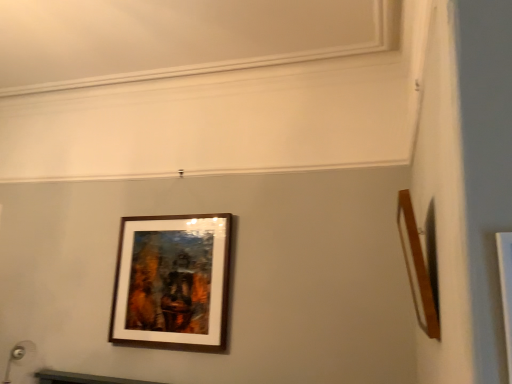
Question: Could you tell me if wooden frame at right, the 2th picture frame in the left-to-right sequence, is turned towards wooden frame at center, which appears as the first picture frame when viewed from the back?

Choices:
 (A) no
 (B) yes

Answer: (B)

Question: Considering the relative positions of wooden frame at right, which is the 1th picture frame in right-to-left order, and wooden frame at center, which appears as the first picture frame when viewed from the back, in the image provided, is wooden frame at right, which is the 1th picture frame in right-to-left order, behind wooden frame at center, which appears as the first picture frame when viewed from the back,?

Choices:
 (A) yes
 (B) no

Answer: (B)

Question: Would you say wooden frame at right, which is the 1th picture frame in right-to-left order, is outside wooden frame at center, which ranks as the 2th picture frame in front-to-back order?

Choices:
 (A) no
 (B) yes

Answer: (B)

Question: From a real-world perspective, is wooden frame at right, which is the 1th picture frame in right-to-left order, on top of wooden frame at center, which appears as the first picture frame when viewed from the back?

Choices:
 (A) no
 (B) yes

Answer: (B)

Question: Considering the relative sizes of wooden frame at right, placed as the first picture frame when sorted from front to back, and wooden frame at center, which ranks as the 2th picture frame in front-to-back order, in the image provided, is wooden frame at right, placed as the first picture frame when sorted from front to back, shorter than wooden frame at center, which ranks as the 2th picture frame in front-to-back order,?

Choices:
 (A) no
 (B) yes

Answer: (B)

Question: Is wooden frame at center, positioned as the 1th picture frame in left-to-right order, inside wooden frame at right, the 2th picture frame in the left-to-right sequence?

Choices:
 (A) no
 (B) yes

Answer: (A)

Question: Can you confirm if wooden frame at center, positioned as the second picture frame in right-to-left order, is wider than wooden frame at right, the 2th picture frame in the left-to-right sequence?

Choices:
 (A) yes
 (B) no

Answer: (B)

Question: From a real-world perspective, is wooden frame at center, which ranks as the 2th picture frame in front-to-back order, beneath wooden frame at right, the 2th picture frame in the left-to-right sequence?

Choices:
 (A) yes
 (B) no

Answer: (A)

Question: Considering the relative positions of wooden frame at center, which appears as the first picture frame when viewed from the back, and wooden frame at right, which is the 1th picture frame in right-to-left order, in the image provided, is wooden frame at center, which appears as the first picture frame when viewed from the back, behind wooden frame at right, which is the 1th picture frame in right-to-left order,?

Choices:
 (A) no
 (B) yes

Answer: (B)

Question: Can you confirm if wooden frame at center, positioned as the second picture frame in right-to-left order, is positioned to the left of wooden frame at right, the 2th picture frame in the left-to-right sequence?

Choices:
 (A) no
 (B) yes

Answer: (B)

Question: From the image's perspective, is wooden frame at center, which appears as the first picture frame when viewed from the back, above wooden frame at right, placed as the first picture frame when sorted from front to back?

Choices:
 (A) yes
 (B) no

Answer: (B)

Question: Could you tell me if wooden frame at center, positioned as the 1th picture frame in left-to-right order, is turned towards wooden frame at right, which is the 1th picture frame in right-to-left order?

Choices:
 (A) yes
 (B) no

Answer: (B)

Question: Is wooden frame at right, the 2th picture frame in the left-to-right sequence, taller or shorter than wooden frame at center, positioned as the 1th picture frame in left-to-right order?

Choices:
 (A) tall
 (B) short

Answer: (B)